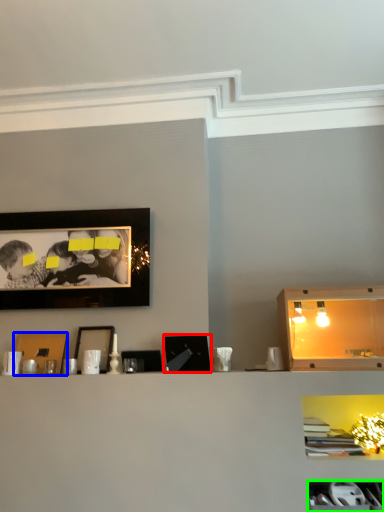
Question: Which object is the farthest from picture frame (highlighted by a red box)? Choose among these: picture frame (highlighted by a blue box) or cabinet (highlighted by a green box).

Choices:
 (A) picture frame
 (B) cabinet

Answer: (B)